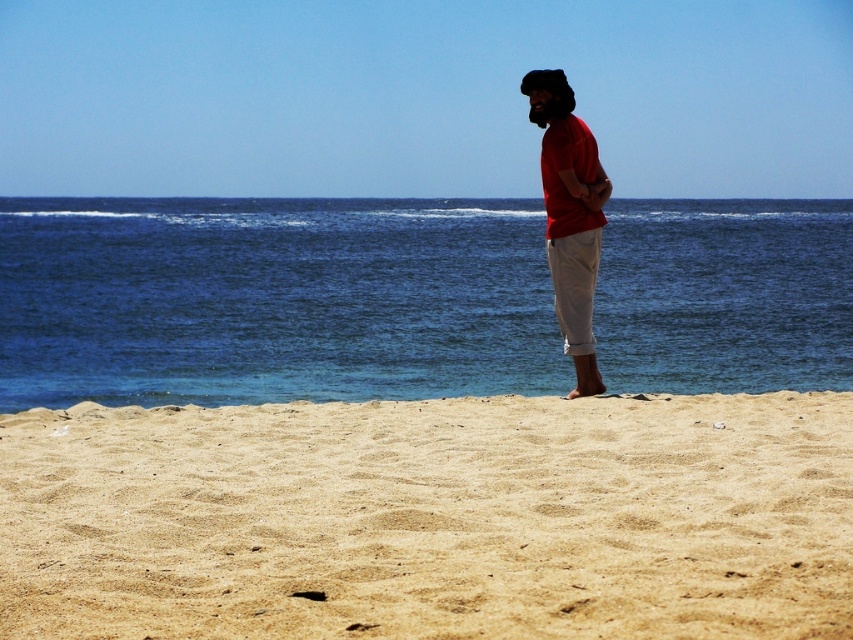
Is fine-grained sand at lower center smaller than blue water at center?

Indeed, fine-grained sand at lower center has a smaller size compared to blue water at center.

In the scene shown: Can you confirm if fine-grained sand at lower center is positioned above blue water at center?

No.

The width and height of the screenshot is (853, 640). I want to click on fine-grained sand at lower center, so click(431, 518).

Locate an element on the screen. The width and height of the screenshot is (853, 640). fine-grained sand at lower center is located at coordinates (431, 518).

Can you confirm if blue water at center is positioned above matte red shirt at center?

Yes, blue water at center is above matte red shirt at center.

This screenshot has height=640, width=853. I want to click on blue water at center, so click(271, 300).

Locate an element on the screen. The image size is (853, 640). blue water at center is located at coordinates (271, 300).

Is fine-grained sand at lower center bigger than matte red shirt at center?

No.

Does fine-grained sand at lower center appear on the right side of matte red shirt at center?

Indeed, fine-grained sand at lower center is positioned on the right side of matte red shirt at center.

This screenshot has height=640, width=853. I want to click on fine-grained sand at lower center, so click(431, 518).